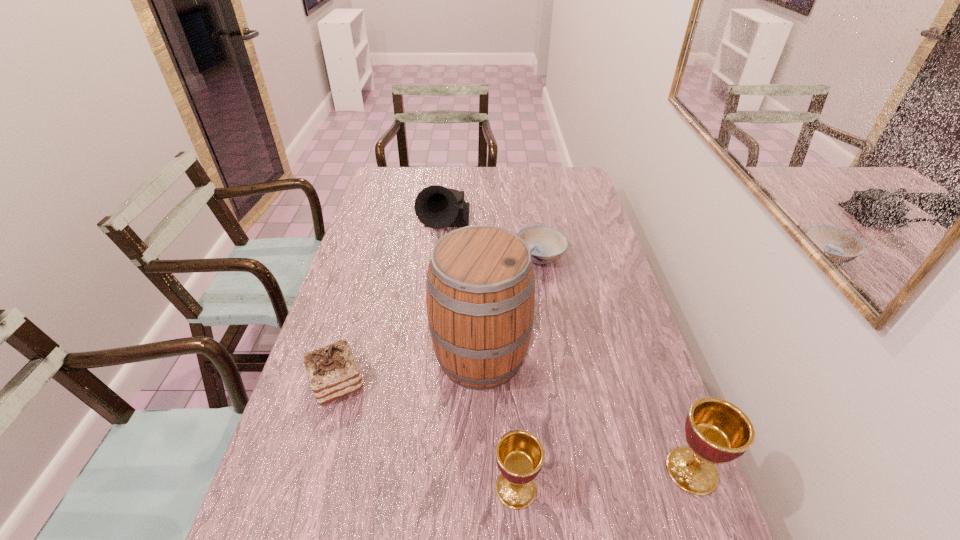
Find the location of a particular element. free space located on the back of the right chalice is located at coordinates (654, 366).

Image resolution: width=960 pixels, height=540 pixels. I want to click on vacant space located 0.140m from the horn of the phonograph_record, so click(436, 286).

What are the coordinates of `free location located on the front of the shortest object` in the screenshot? It's located at (x=556, y=346).

I want to click on vacant area situated 0.230m on the back of the fifth tallest object, so click(361, 299).

Locate an element on the screen. blank space located 0.120m on the right of the tallest object is located at coordinates (573, 356).

Find the location of a particular element. The height and width of the screenshot is (540, 960). object located at the left edge is located at coordinates (332, 370).

Identify the location of chalice that is at the right edge. The image size is (960, 540). (717, 431).

Where is `bowl that is at the right edge`? The height and width of the screenshot is (540, 960). bowl that is at the right edge is located at coordinates (546, 244).

Identify the location of object situated at the near right corner. The width and height of the screenshot is (960, 540). (717, 431).

Locate an element on the screen. vacant space at the far edge of the desktop is located at coordinates (536, 174).